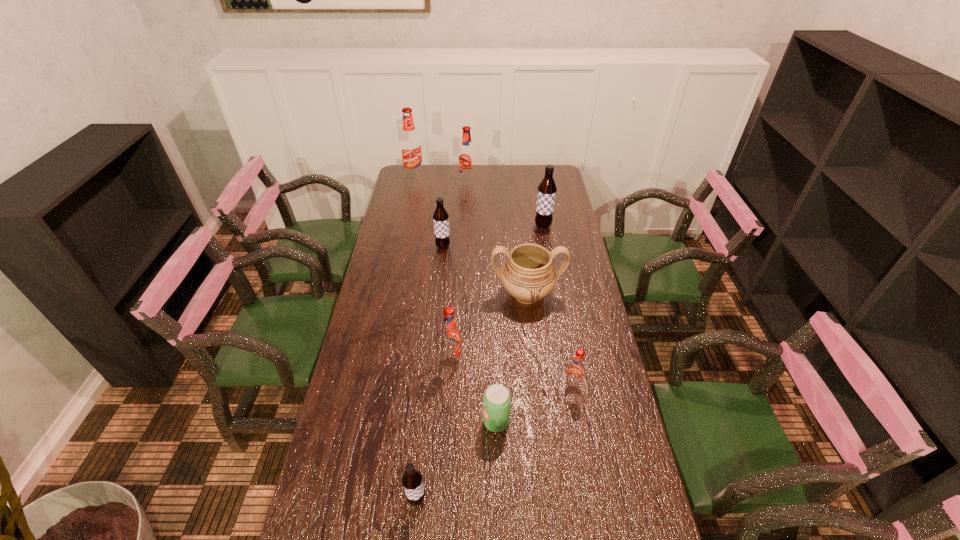
The image size is (960, 540). I want to click on vacant space that satisfies the following two spatial constraints: 1. on the front-facing side of the smallest red root beer; 2. on the left side of the urn, so click(537, 387).